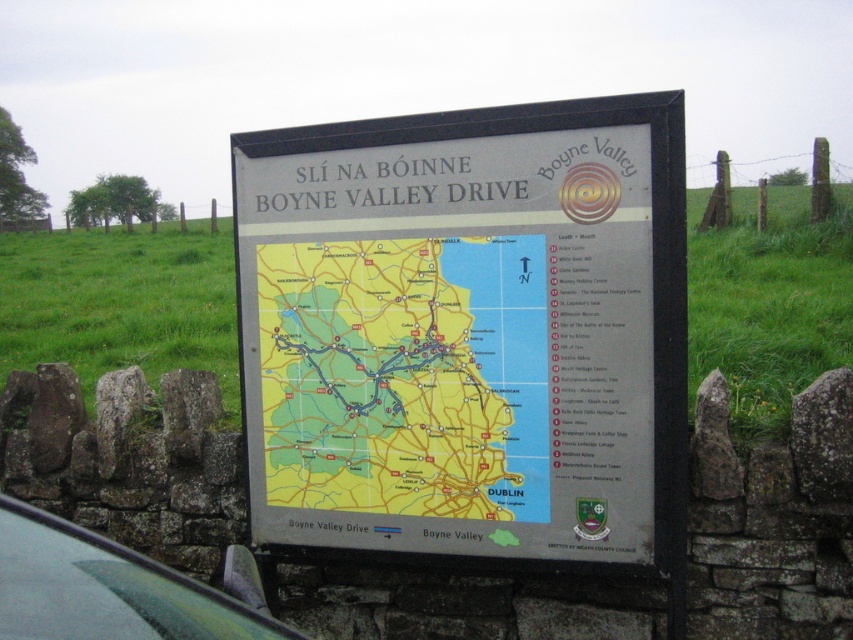
Who is more forward, [291,317] or [120,554]?

Point [120,554] is more forward.

Does yellow paper map at center have a greater height compared to green matte car at lower left?

Yes.

Which is behind, point (492, 269) or point (13, 563)?

Positioned behind is point (492, 269).

Where is `yellow paper map at center`? This screenshot has width=853, height=640. yellow paper map at center is located at coordinates [x=405, y=376].

Is white plastic sign at center wider than green matte car at lower left?

Yes, white plastic sign at center is wider than green matte car at lower left.

Can you confirm if white plastic sign at center is bigger than green matte car at lower left?

Yes, white plastic sign at center is bigger than green matte car at lower left.

The image size is (853, 640). Find the location of `white plastic sign at center`. white plastic sign at center is located at coordinates [x=467, y=330].

Who is positioned more to the right, white plastic sign at center or yellow paper map at center?

white plastic sign at center is more to the right.

Who is more forward, (x=456, y=508) or (x=416, y=268)?

Point (x=416, y=268) is in front.

This screenshot has width=853, height=640. I want to click on white plastic sign at center, so click(467, 330).